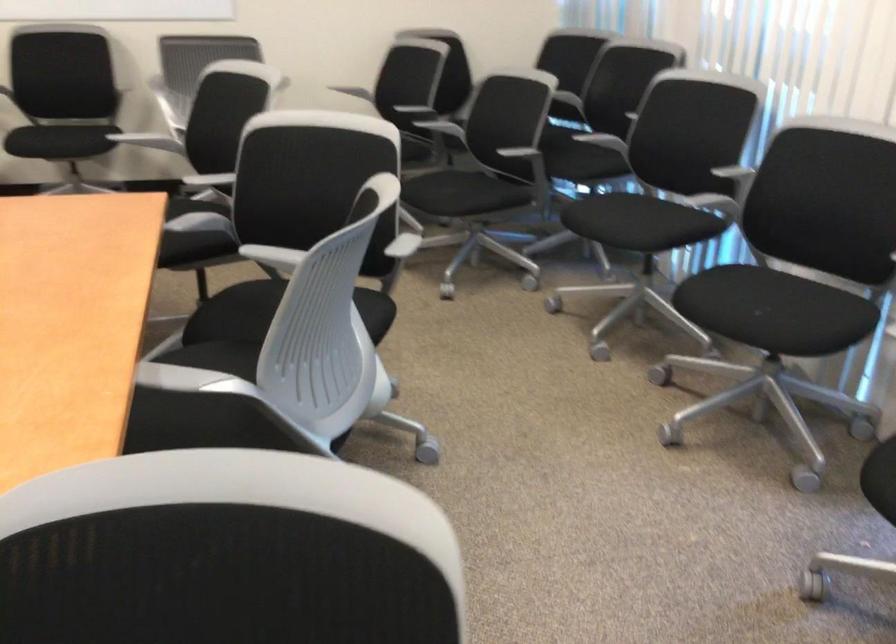
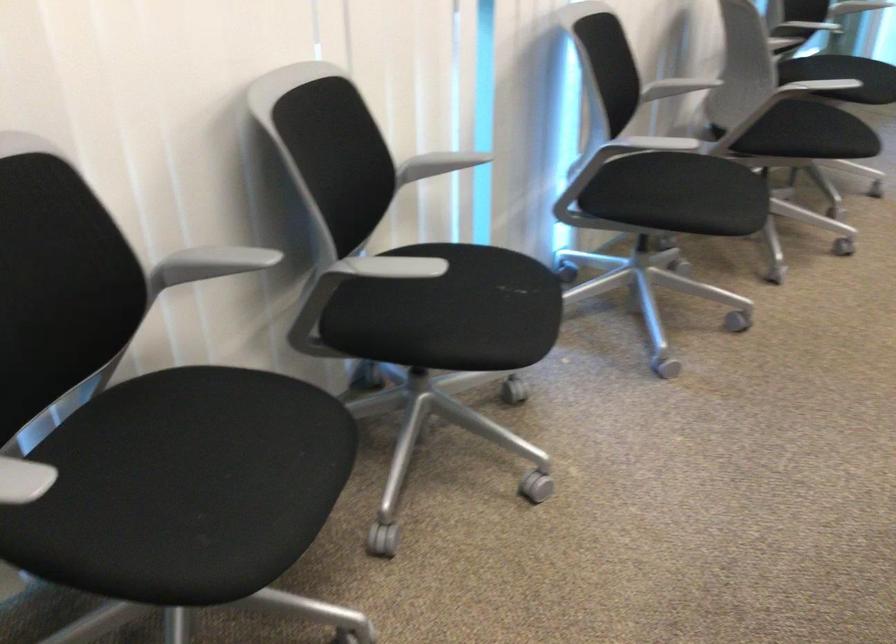
Find the pixel in the second image that matches [754,319] in the first image.

(515, 287)